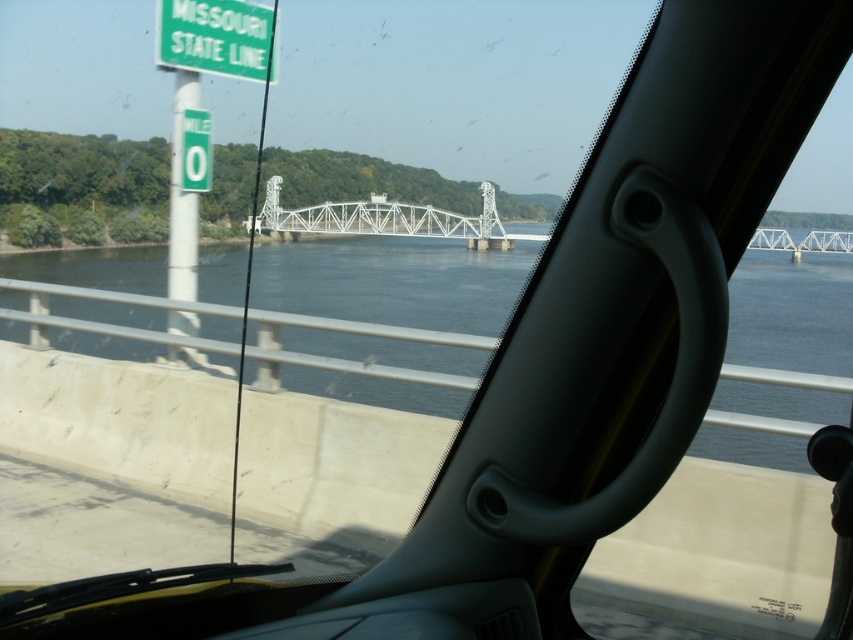
Question: Is dark blue water at center wider than green matte sign at upper left?

Choices:
 (A) no
 (B) yes

Answer: (B)

Question: Which is nearer to the dark blue water at center?

Choices:
 (A) white metallic bridge at center
 (B) green matte sign at upper left

Answer: (A)

Question: Which of the following is the closest to the observer?

Choices:
 (A) dark blue water at center
 (B) green matte sign at upper left

Answer: (A)

Question: Where is dark blue water at center located in relation to white metallic bridge at center in the image?

Choices:
 (A) left
 (B) right

Answer: (B)

Question: Is green matte sign at upper left smaller than white metallic bridge at center?

Choices:
 (A) yes
 (B) no

Answer: (A)

Question: Which object is closer to the camera taking this photo?

Choices:
 (A) dark blue water at center
 (B) green matte sign at upper left

Answer: (A)